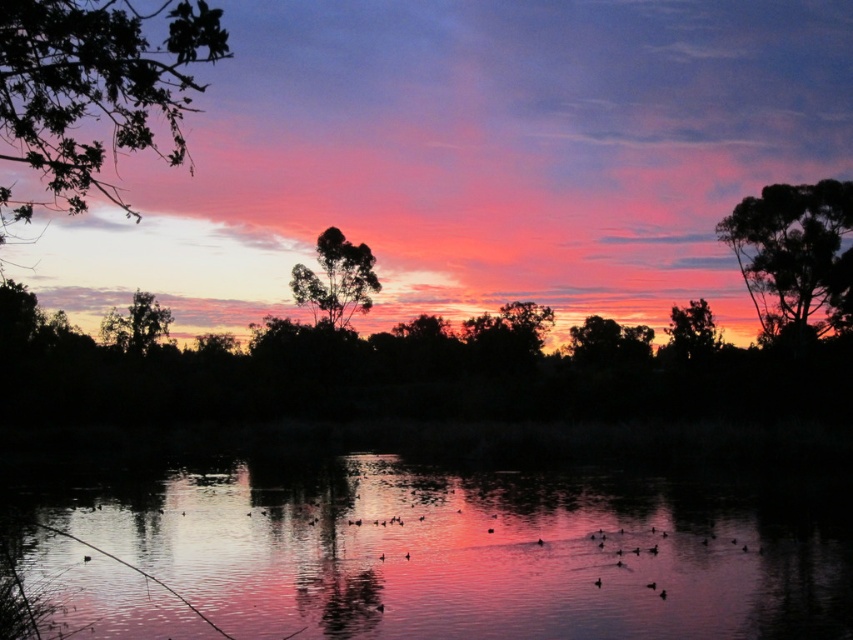
Question: Which of the following is the farthest from the observer?

Choices:
 (A) dark green leafy tree at upper center
 (B) silky black tree at center

Answer: (B)

Question: Estimate the real-world distances between objects in this image. Which object is farther from the green leafy tree at upper right?

Choices:
 (A) green leafy tree at upper left
 (B) green leafy tree at left
 (C) reflective water at center

Answer: (A)

Question: Can you confirm if green leafy tree at upper left is bigger than silky black tree at center?

Choices:
 (A) no
 (B) yes

Answer: (B)

Question: Does silhouette tree at right appear on the right side of dark green leafy tree at upper center?

Choices:
 (A) no
 (B) yes

Answer: (B)

Question: Which point is farther to the camera?

Choices:
 (A) silhouette tree at right
 (B) reflective water at center
 (C) green leafy tree at left
 (D) dark green leafy tree at upper center

Answer: (C)

Question: Is green leafy tree at upper left thinner than green leafy tree at left?

Choices:
 (A) no
 (B) yes

Answer: (A)